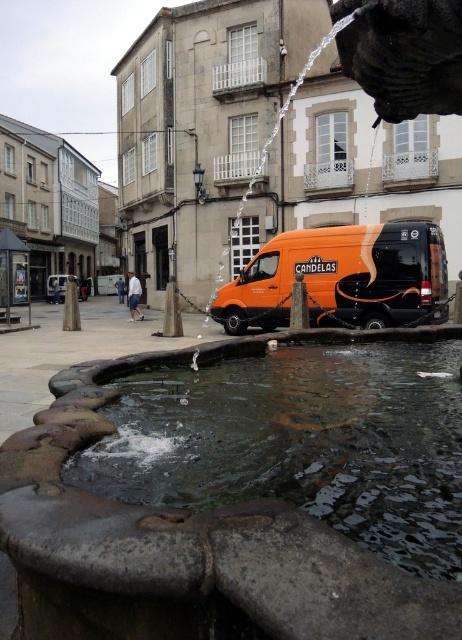
Is dark gray stone water at center positioned in front of orange matte van at center?

Yes, dark gray stone water at center is closer to the viewer.

Is dark gray stone water at center to the left of orange matte van at center from the viewer's perspective?

Indeed, dark gray stone water at center is positioned on the left side of orange matte van at center.

Locate an element on the screen. dark gray stone water at center is located at coordinates (299, 442).

Find the location of a particular element. This screenshot has width=462, height=640. dark gray stone water at center is located at coordinates (299, 442).